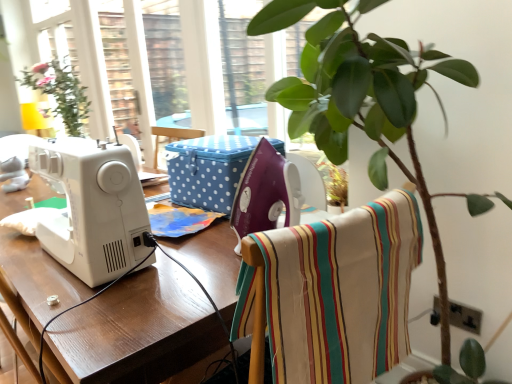
Question: From the image's perspective, is white glossy sewing machine at left beneath striped cotton fabric at center?

Choices:
 (A) yes
 (B) no

Answer: (A)

Question: Considering the relative sizes of white glossy sewing machine at left and striped cotton fabric at center in the image provided, is white glossy sewing machine at left taller than striped cotton fabric at center?

Choices:
 (A) no
 (B) yes

Answer: (B)

Question: Can you confirm if white glossy sewing machine at left is positioned to the right of striped cotton fabric at center?

Choices:
 (A) no
 (B) yes

Answer: (A)

Question: Is the position of white glossy sewing machine at left more distant than that of striped cotton fabric at center?

Choices:
 (A) no
 (B) yes

Answer: (B)

Question: Can striped cotton fabric at center be found inside white glossy sewing machine at left?

Choices:
 (A) yes
 (B) no

Answer: (B)

Question: From a real-world perspective, is white glossy sewing machine at left positioned over striped cotton fabric at center based on gravity?

Choices:
 (A) no
 (B) yes

Answer: (A)

Question: Is the surface of striped cotton fabric at center in direct contact with blue polka dot fabric box at center?

Choices:
 (A) no
 (B) yes

Answer: (A)

Question: Is striped cotton fabric at center positioned with its back to blue polka dot fabric box at center?

Choices:
 (A) no
 (B) yes

Answer: (A)

Question: Is the position of striped cotton fabric at center more distant than that of blue polka dot fabric box at center?

Choices:
 (A) yes
 (B) no

Answer: (B)

Question: Does striped cotton fabric at center appear on the right side of blue polka dot fabric box at center?

Choices:
 (A) no
 (B) yes

Answer: (B)

Question: From the image's perspective, is striped cotton fabric at center above blue polka dot fabric box at center?

Choices:
 (A) yes
 (B) no

Answer: (B)

Question: Considering the relative sizes of striped cotton fabric at center and blue polka dot fabric box at center in the image provided, is striped cotton fabric at center thinner than blue polka dot fabric box at center?

Choices:
 (A) no
 (B) yes

Answer: (B)

Question: Does white glossy sewing machine at left come behind blue polka dot fabric box at center?

Choices:
 (A) yes
 (B) no

Answer: (B)